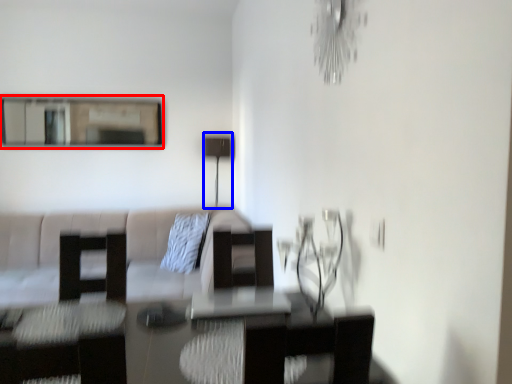
Question: Which object is closer to the camera taking this photo, mirror (highlighted by a red box) or lamp (highlighted by a blue box)?

Choices:
 (A) mirror
 (B) lamp

Answer: (A)